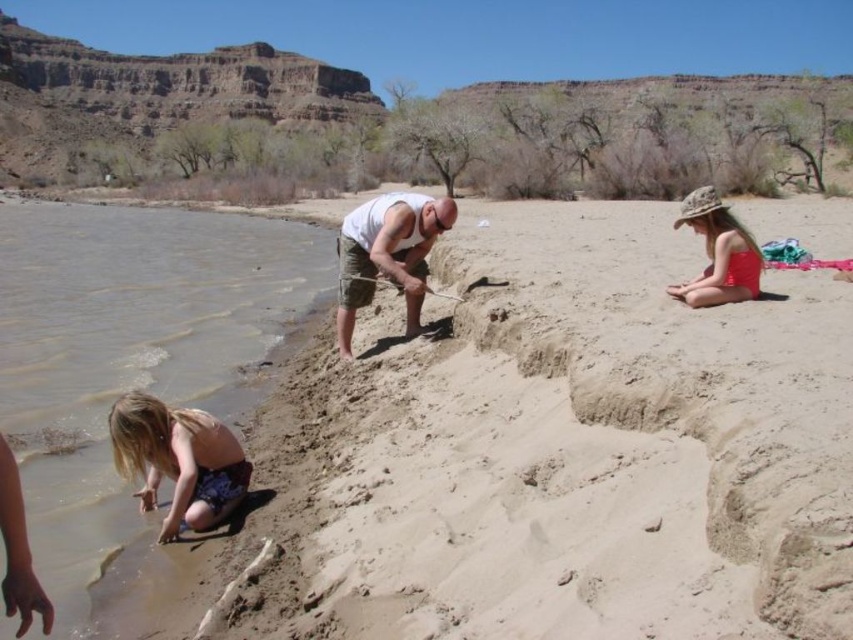
You are standing at the white tank top at center and want to throw a pebble into the clear water at lower left. If the pebble can travel 80 feet, will it reach the water?

The clear water at lower left is 79.43 feet from the white tank top at center, so yes, the pebble can reach the water since it can travel 80 feet.

From the picture: You are a photographer standing at the riverbank. You want to capture a photo of the blonde hair girl at lower left and the clear water at lower left in the same frame. According to the scene description, which object is closer to the camera so that it will appear larger in the photo?

The clear water at lower left is positioned over blonde hair girl at lower left, meaning it is closer to the camera. Therefore, the clear water at lower left will appear larger in the photo.